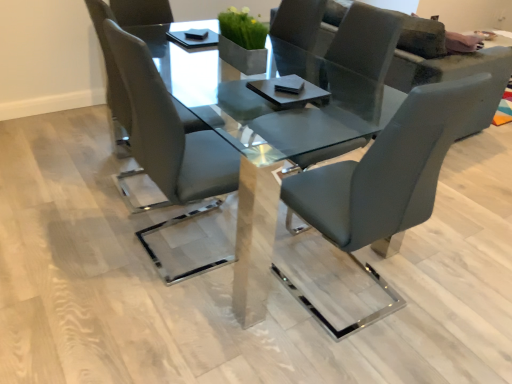
You are a GUI agent. You are given a task and a screenshot of the screen. Output one action in this format:
    pyautogui.click(x=<x>, y=<y>)
    Task: Click on the matte gray chair at center, which is the 2th chair in left-to-right order
    Image resolution: width=512 pixels, height=384 pixels.
    Given the screenshot: What is the action you would take?
    [x=336, y=88]

The height and width of the screenshot is (384, 512). What do you see at coordinates (336, 88) in the screenshot?
I see `matte gray chair at center, which is the 2th chair in left-to-right order` at bounding box center [336, 88].

What is the approximate width of matte gray couch at upper right?

matte gray couch at upper right is 1.02 meters wide.

You are a GUI agent. You are given a task and a screenshot of the screen. Output one action in this format:
    pyautogui.click(x=<x>, y=<y>)
    Task: Click on the matte gray chair at center, placed as the 1th chair when sorted from right to left
    
    Given the screenshot: What is the action you would take?
    pyautogui.click(x=383, y=184)

In the scene shown: Considering the sizes of objects clear glass table at center and matte gray chair at center, arranged as the third chair when viewed from the left, in the image provided, who is thinner, clear glass table at center or matte gray chair at center, arranged as the third chair when viewed from the left,?

matte gray chair at center, arranged as the third chair when viewed from the left.

Is clear glass table at center taller than matte gray chair at center, arranged as the third chair when viewed from the left?

No.

Is clear glass table at center outside of matte gray chair at center, arranged as the third chair when viewed from the left?

Yes.

Between clear glass table at center and matte gray chair at center, placed as the 1th chair when sorted from right to left, which one appears on the left side from the viewer's perspective?

Positioned to the left is clear glass table at center.

Considering the sizes of objects clear glass table at center and matte gray chair at center, which appears as the 2th chair when viewed from the right, in the image provided, who is thinner, clear glass table at center or matte gray chair at center, which appears as the 2th chair when viewed from the right,?

matte gray chair at center, which appears as the 2th chair when viewed from the right, is thinner.

Is matte gray chair at center, which is the 2th chair in left-to-right order, surrounded by clear glass table at center?

That's correct, matte gray chair at center, which is the 2th chair in left-to-right order, is inside clear glass table at center.

Between clear glass table at center and matte gray chair at center, which is the 2th chair in left-to-right order, which one has more height?

Standing taller between the two is matte gray chair at center, which is the 2th chair in left-to-right order.

From the image's perspective, which one is positioned higher, clear glass table at center or matte gray chair at center, which is the 2th chair in left-to-right order?

matte gray chair at center, which is the 2th chair in left-to-right order.

Does point (164, 19) lie in front of point (473, 89)?

No, it is not.

From a real-world perspective, between satin grey leather chair at center, marked as the 3th chair in a right-to-left arrangement, and matte gray chair at center, arranged as the third chair when viewed from the left, who is vertically higher?

From a 3D spatial view, matte gray chair at center, arranged as the third chair when viewed from the left, is above.

How far apart are satin grey leather chair at center, marked as the 3th chair in a right-to-left arrangement, and matte gray chair at center, placed as the 1th chair when sorted from right to left?

The distance of satin grey leather chair at center, marked as the 3th chair in a right-to-left arrangement, from matte gray chair at center, placed as the 1th chair when sorted from right to left, is 95.17 centimeters.

Is satin grey leather chair at center, marked as the 3th chair in a right-to-left arrangement, thinner than matte gray chair at center, placed as the 1th chair when sorted from right to left?

Correct, the width of satin grey leather chair at center, marked as the 3th chair in a right-to-left arrangement, is less than that of matte gray chair at center, placed as the 1th chair when sorted from right to left.

In the image, is matte gray couch at upper right positioned in front of or behind matte gray chair at center, arranged as the third chair when viewed from the left?

matte gray couch at upper right is behind matte gray chair at center, arranged as the third chair when viewed from the left.

Is matte gray couch at upper right facing away from matte gray chair at center, arranged as the third chair when viewed from the left?

Correct, matte gray couch at upper right is looking away from matte gray chair at center, arranged as the third chair when viewed from the left.

Is matte gray couch at upper right beside matte gray chair at center, arranged as the third chair when viewed from the left?

There is a gap between matte gray couch at upper right and matte gray chair at center, arranged as the third chair when viewed from the left.

Which object is thinner, matte gray couch at upper right or matte gray chair at center, placed as the 1th chair when sorted from right to left?

matte gray chair at center, placed as the 1th chair when sorted from right to left, is thinner.

Which of these two, matte gray couch at upper right or clear glass table at center, is bigger?

matte gray couch at upper right is bigger.

Considering the points (415, 55) and (183, 81), which point is behind, point (415, 55) or point (183, 81)?

The point (415, 55) is behind.

From the picture: Is matte gray couch at upper right wider or thinner than clear glass table at center?

Considering their sizes, matte gray couch at upper right looks broader than clear glass table at center.

From a real-world perspective, is matte gray couch at upper right positioned under clear glass table at center based on gravity?

No, from a real-world perspective, matte gray couch at upper right is not below clear glass table at center.

Which object is thinner, satin grey leather chair at center, which is counted as the first chair, starting from the left, or matte gray chair at center, which appears as the 2th chair when viewed from the right?

Thinner between the two is satin grey leather chair at center, which is counted as the first chair, starting from the left.

Is satin grey leather chair at center, which is counted as the first chair, starting from the left, inside the boundaries of matte gray chair at center, which appears as the 2th chair when viewed from the right, or outside?

satin grey leather chair at center, which is counted as the first chair, starting from the left, is not enclosed by matte gray chair at center, which appears as the 2th chair when viewed from the right.

Which object is positioned more to the right, satin grey leather chair at center, which is counted as the first chair, starting from the left, or matte gray chair at center, which appears as the 2th chair when viewed from the right?

From the viewer's perspective, matte gray chair at center, which appears as the 2th chair when viewed from the right, appears more on the right side.

From the picture: Is satin grey leather chair at center, which is counted as the first chair, starting from the left, to the right of matte gray couch at upper right from the viewer's perspective?

No, satin grey leather chair at center, which is counted as the first chair, starting from the left, is not to the right of matte gray couch at upper right.

Is satin grey leather chair at center, marked as the 3th chair in a right-to-left arrangement, inside or outside of matte gray couch at upper right?

satin grey leather chair at center, marked as the 3th chair in a right-to-left arrangement, lies outside matte gray couch at upper right.

Which of these two, satin grey leather chair at center, which is counted as the first chair, starting from the left, or matte gray couch at upper right, is thinner?

Thinner between the two is satin grey leather chair at center, which is counted as the first chair, starting from the left.

From the image's perspective, is satin grey leather chair at center, which is counted as the first chair, starting from the left, above or below matte gray couch at upper right?

Based on their image positions, satin grey leather chair at center, which is counted as the first chair, starting from the left, is located beneath matte gray couch at upper right.

Identify the location of table that is behind the matte gray chair at center, arranged as the third chair when viewed from the left. This screenshot has width=512, height=384. (269, 142).

Locate an element on the screen. the 2nd chair above the clear glass table at center (from a real-world perspective) is located at coordinates (336, 88).

Based on their spatial positions, is matte gray couch at upper right or clear glass table at center closer to matte gray chair at center, which is the 2th chair in left-to-right order?

Based on the image, clear glass table at center appears to be nearer to matte gray chair at center, which is the 2th chair in left-to-right order.

When comparing their distances from satin grey leather chair at center, which is counted as the first chair, starting from the left, does clear glass table at center or matte gray chair at center, placed as the 1th chair when sorted from right to left, seem closer?

clear glass table at center.

Estimate the real-world distances between objects in this image. Which object is further from matte gray chair at center, which is the 2th chair in left-to-right order, satin grey leather chair at center, marked as the 3th chair in a right-to-left arrangement, or matte gray chair at center, placed as the 1th chair when sorted from right to left?

satin grey leather chair at center, marked as the 3th chair in a right-to-left arrangement, is further to matte gray chair at center, which is the 2th chair in left-to-right order.

Looking at the image, which one is located closer to clear glass table at center, satin grey leather chair at center, which is counted as the first chair, starting from the left, or matte gray chair at center, arranged as the third chair when viewed from the left?

matte gray chair at center, arranged as the third chair when viewed from the left.

When comparing their distances from clear glass table at center, does matte gray chair at center, which appears as the 2th chair when viewed from the right, or matte gray couch at upper right seem further?

matte gray couch at upper right.

Based on the photo, from the image, which object appears to be farther from clear glass table at center, matte gray chair at center, arranged as the third chair when viewed from the left, or matte gray chair at center, which appears as the 2th chair when viewed from the right?

matte gray chair at center, arranged as the third chair when viewed from the left, lies further to clear glass table at center than the other object.

From the image, which object appears to be nearer to matte gray chair at center, placed as the 1th chair when sorted from right to left, matte gray couch at upper right or matte gray chair at center, which appears as the 2th chair when viewed from the right?

Among the two, matte gray chair at center, which appears as the 2th chair when viewed from the right, is located nearer to matte gray chair at center, placed as the 1th chair when sorted from right to left.

Looking at the image, which one is located further to clear glass table at center, satin grey leather chair at center, marked as the 3th chair in a right-to-left arrangement, or matte gray couch at upper right?

The object further to clear glass table at center is matte gray couch at upper right.

The height and width of the screenshot is (384, 512). Identify the location of table between satin grey leather chair at center, which is counted as the first chair, starting from the left, and matte gray chair at center, which appears as the 2th chair when viewed from the right, from left to right. (269, 142).

Find the location of `table between satin grey leather chair at center, which is counted as the first chair, starting from the left, and matte gray chair at center, arranged as the third chair when viewed from the left`. table between satin grey leather chair at center, which is counted as the first chair, starting from the left, and matte gray chair at center, arranged as the third chair when viewed from the left is located at coordinates (269, 142).

Locate an element on the screen. table positioned between matte gray chair at center, arranged as the third chair when viewed from the left, and matte gray couch at upper right from near to far is located at coordinates (269, 142).

Locate an element on the screen. chair between clear glass table at center and matte gray chair at center, arranged as the third chair when viewed from the left, in the horizontal direction is located at coordinates [x=336, y=88].